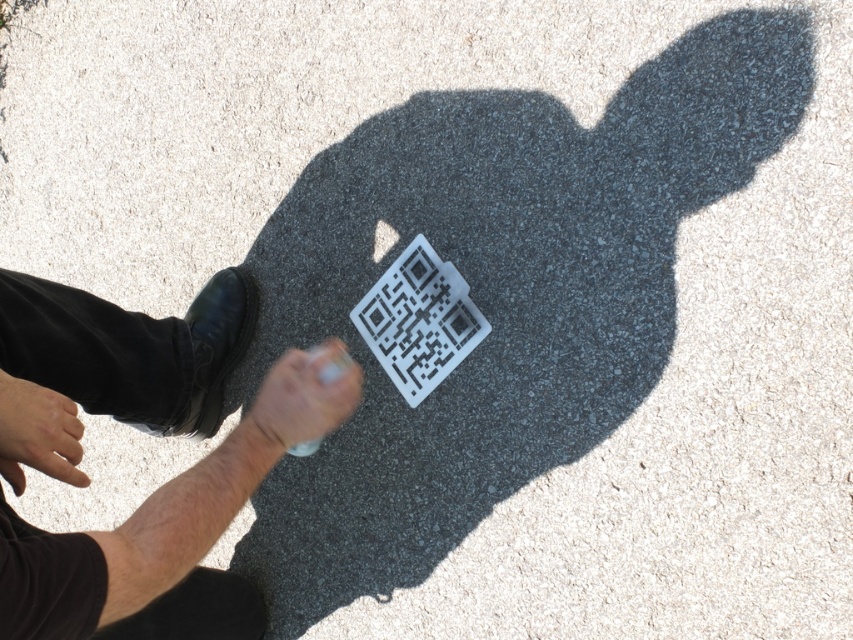
Question: Is transparent plastic qr code at center below smooth skin hand at lower left?

Choices:
 (A) no
 (B) yes

Answer: (A)

Question: Among these points, which one is nearest to the camera?

Choices:
 (A) (428, 256)
 (B) (305, 433)
 (C) (283, 364)
 (D) (28, 416)

Answer: (D)

Question: Is black leather shoe at lower left above white matte hand at center?

Choices:
 (A) yes
 (B) no

Answer: (B)

Question: Which point appears farthest from the camera in this image?

Choices:
 (A) (236, 602)
 (B) (32, 458)
 (C) (403, 340)

Answer: (A)

Question: Which point appears farthest from the camera in this image?

Choices:
 (A) (33, 397)
 (B) (349, 410)

Answer: (B)

Question: Can you confirm if transparent plastic qr code at center is bigger than white matte hand at center?

Choices:
 (A) yes
 (B) no

Answer: (B)